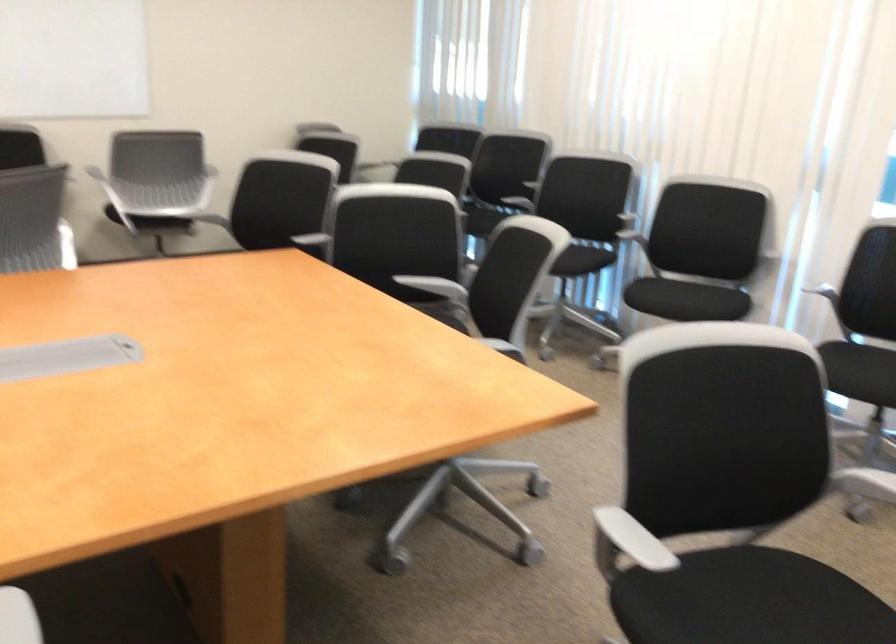
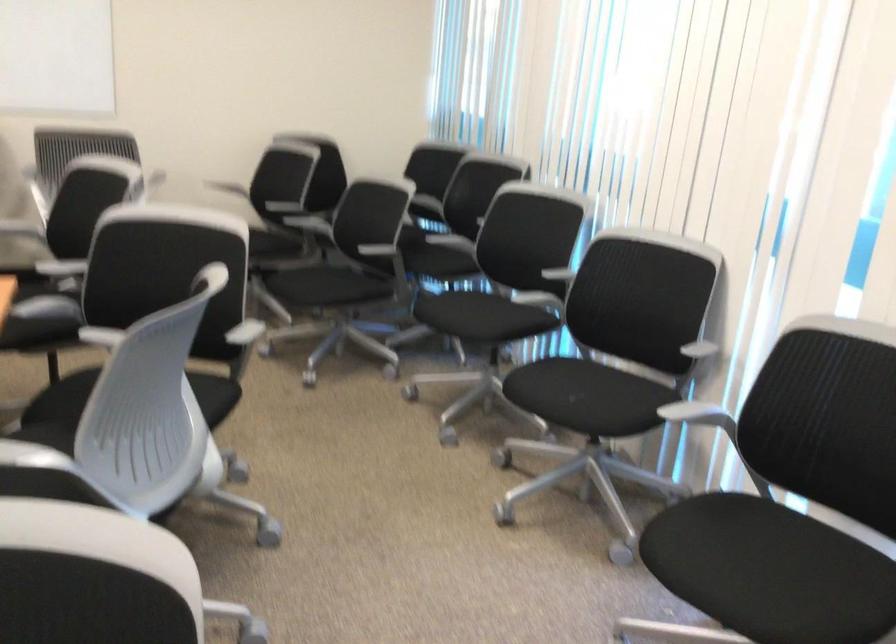
The images are taken continuously from a first-person perspective. In which direction are you moving?

The cameraman moved toward right, forward.